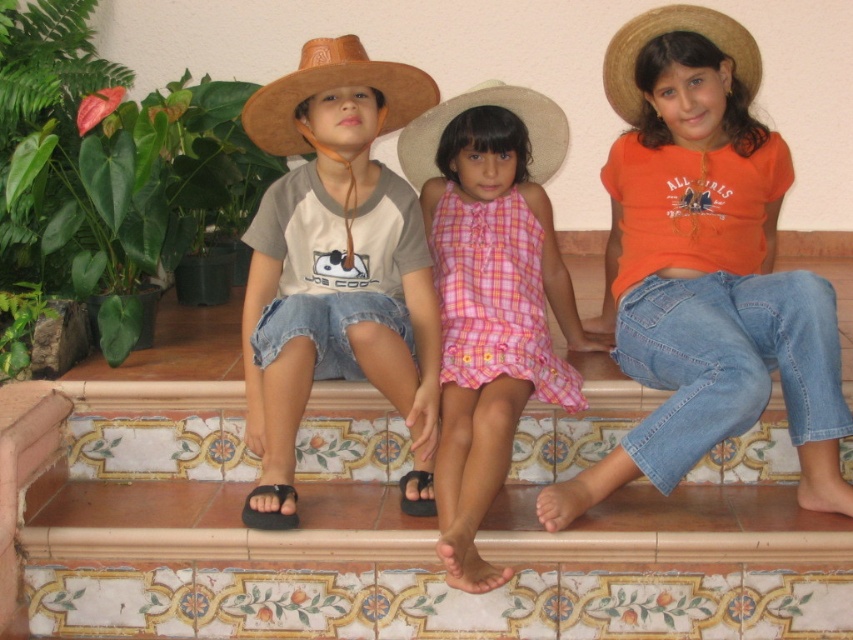
Does black rubber sandal at lower left lie in front of black synthetic sandal at lower center?

Yes, it is.

Locate an element on the screen. Image resolution: width=853 pixels, height=640 pixels. black rubber sandal at lower left is located at coordinates (270, 509).

Based on the photo, is brown leather hat at left closer to the viewer compared to straw hat at upper right?

That is True.

Which is more to the left, brown leather hat at left or straw hat at upper right?

Positioned to the left is brown leather hat at left.

What do you see at coordinates (335, 252) in the screenshot? I see `brown leather hat at left` at bounding box center [335, 252].

This screenshot has height=640, width=853. In order to click on brown leather hat at left in this screenshot , I will do `click(335, 252)`.

Is point (640, 26) more distant than point (252, 490)?

Yes.

Between orange cotton shirt at center and black rubber sandal at lower left, which one has less height?

black rubber sandal at lower left is shorter.

Is point (695, 342) farther from viewer compared to point (257, 492)?

No, it is not.

You are a GUI agent. You are given a task and a screenshot of the screen. Output one action in this format:
    pyautogui.click(x=<x>, y=<y>)
    Task: Click on the orange cotton shirt at center
    The height and width of the screenshot is (640, 853).
    Given the screenshot: What is the action you would take?
    pyautogui.click(x=704, y=268)